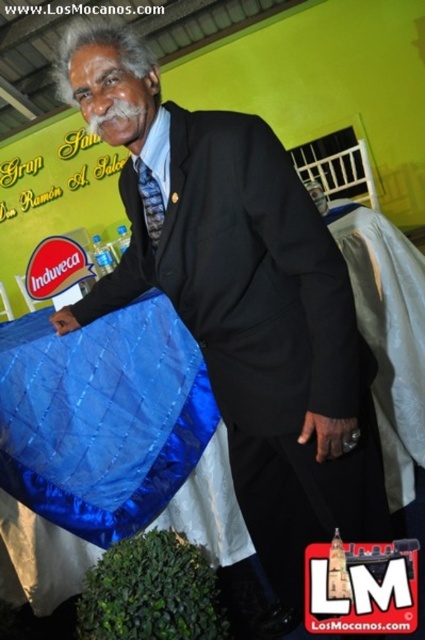
Question: Is the position of blue shiny bag at lower left more distant than that of white fabric at right?

Choices:
 (A) no
 (B) yes

Answer: (A)

Question: Can you confirm if blue shiny bag at lower left is positioned to the right of white fabric at right?

Choices:
 (A) yes
 (B) no

Answer: (B)

Question: Can you confirm if blue shiny bag at lower left is positioned above white fabric at right?

Choices:
 (A) no
 (B) yes

Answer: (A)

Question: Which point is farther to the camera?

Choices:
 (A) white fabric at right
 (B) blue shiny bag at lower left

Answer: (A)

Question: Among these points, which one is farthest from the camera?

Choices:
 (A) (408, 397)
 (B) (85, 564)

Answer: (A)

Question: Among these objects, which one is farthest from the camera?

Choices:
 (A) blue shiny bag at lower left
 (B) white fabric at right

Answer: (B)